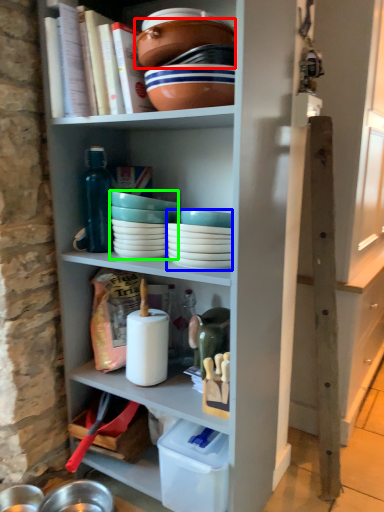
Question: Which object is positioned farthest from bowl (highlighted by a red box)? Select from tableware (highlighted by a blue box) and tableware (highlighted by a green box).

Choices:
 (A) tableware
 (B) tableware

Answer: (A)